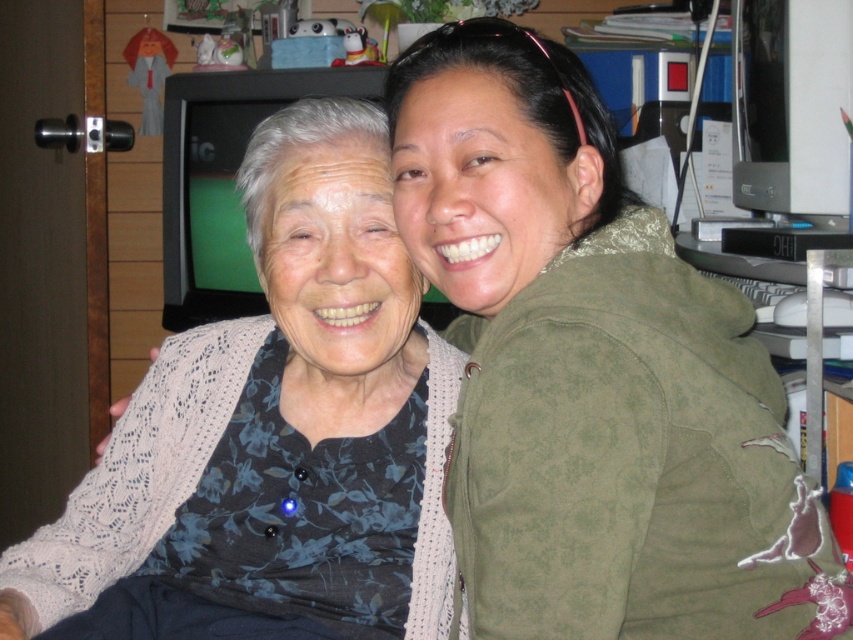
Is point (751, 461) positioned before point (318, 292)?

Yes, point (751, 461) is closer to viewer.

Is matte black sweater at left below floral knit cardigan at center?

No.

Who is more forward, (616,221) or (113,588)?

Point (616,221)

In order to click on matte black sweater at left in this screenshot , I will do `click(592, 372)`.